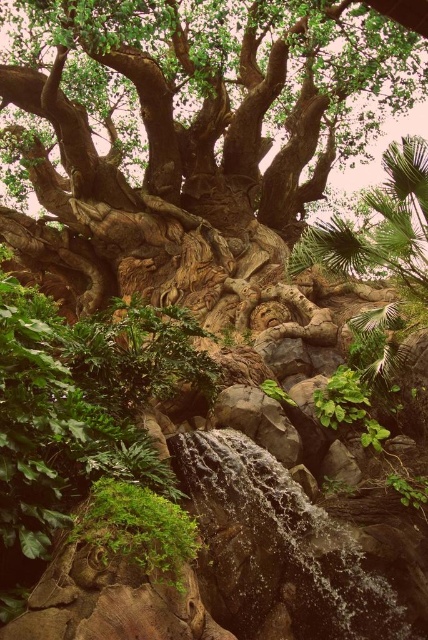
You are standing in front of the Tree of Life and notice a specific point marked at coordinates (189,136). Based on the scene description, what does this point indicate?

The point at coordinates (189,136) marks the location of the green rough bark tree at center.

You are standing in front of the Tree of Life and want to take a photo of both the clear water at center and the green mossy rock at lower left. Which object should you focus on first to ensure both are in sharp focus?

You should focus on the green mossy rock at lower left first because it is closer to you than the clear water at center, which is further away. By focusing on the closer object, you can ensure both are within the depth of field for sharpness.